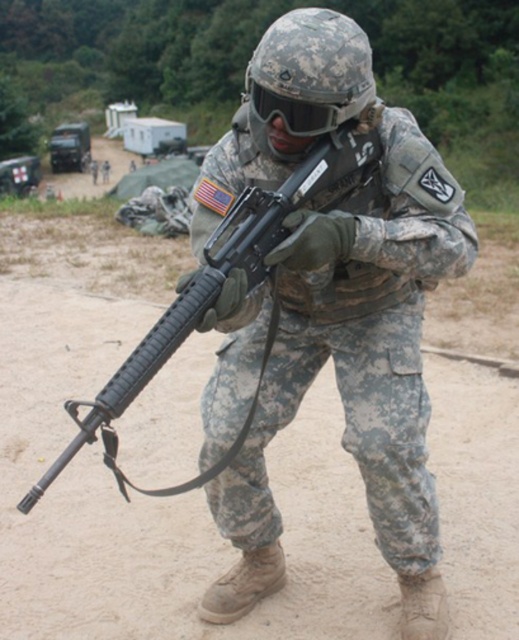
Question: Which object is the closest to the dirt track at center?

Choices:
 (A) camouflage uniform at center
 (B) black matte rifle at center

Answer: (A)

Question: Which point appears closest to the camera in this image?

Choices:
 (A) (256, 205)
 (B) (307, 262)

Answer: (B)

Question: Can you confirm if camouflage uniform at center is positioned to the right of black matte rifle at center?

Choices:
 (A) no
 (B) yes

Answer: (B)

Question: Is camouflage uniform at center bigger than black matte rifle at center?

Choices:
 (A) yes
 (B) no

Answer: (A)

Question: Which object is closer to the camera taking this photo?

Choices:
 (A) camouflage uniform at center
 (B) black matte rifle at center
 (C) dirt track at center

Answer: (B)

Question: Is camouflage uniform at center positioned in front of black matte rifle at center?

Choices:
 (A) no
 (B) yes

Answer: (A)